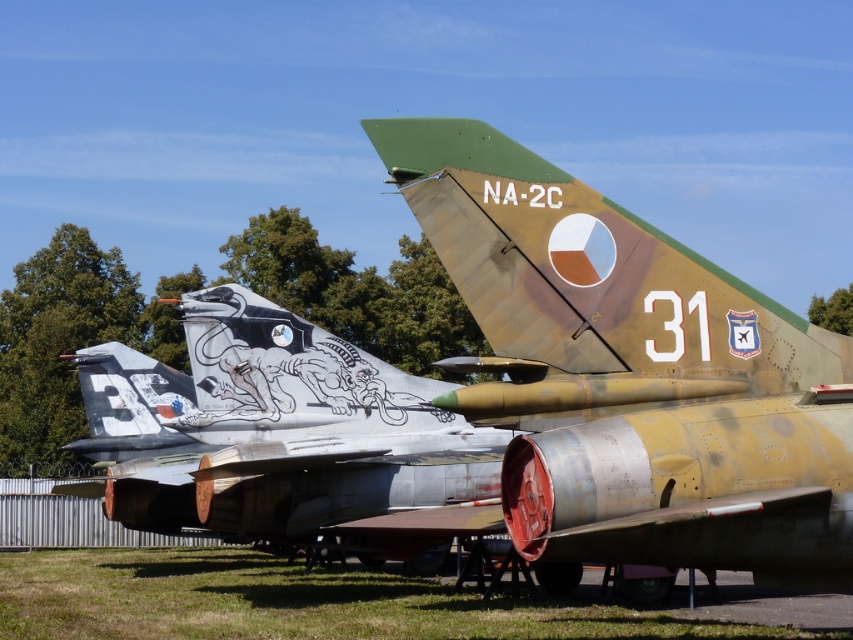
Question: Does camouflage paint airplane at center come behind silver metallic aircraft at center?

Choices:
 (A) no
 (B) yes

Answer: (A)

Question: Estimate the real-world distances between objects in this image. Which object is closer to the camouflage paint tail at center?

Choices:
 (A) camouflage paint airplane at center
 (B) silver metallic aircraft at center

Answer: (A)

Question: Which of these objects is positioned closest to the camouflage paint tail at center?

Choices:
 (A) camouflage paint airplane at center
 (B) green grass at lower center

Answer: (A)

Question: Does camouflage paint airplane at center have a greater width compared to camouflage paint tail at center?

Choices:
 (A) yes
 (B) no

Answer: (A)

Question: Which point is closer to the camera?

Choices:
 (A) camouflage paint tail at center
 (B) green grass at lower center
 (C) silver metallic aircraft at center

Answer: (C)

Question: In this image, where is camouflage paint airplane at center located relative to silver metallic aircraft at center?

Choices:
 (A) right
 (B) left

Answer: (A)